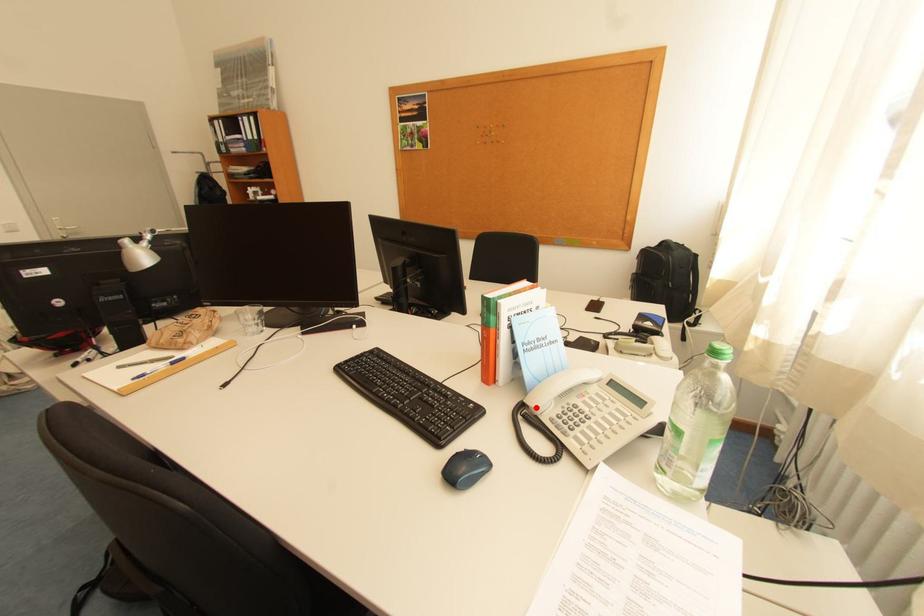
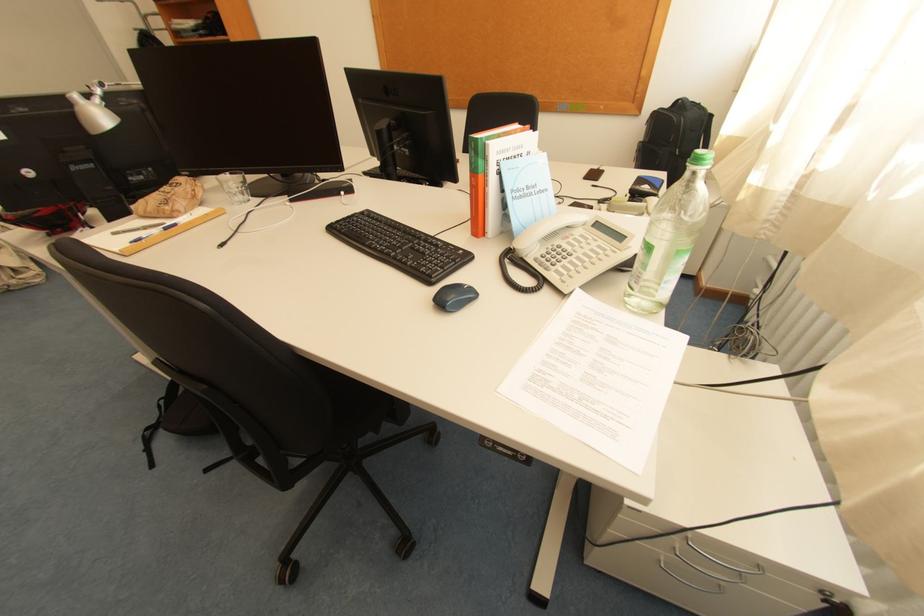
In the second image, find the point that corresponds to the highlighted location in the first image.

(523, 251)